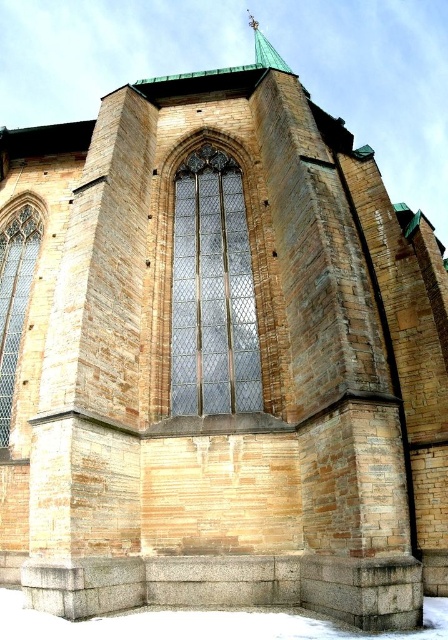
You are standing in front of the historic stone church and want to take a photo of the clear glass window at center. However, you notice the green copper spire at upper center might block your view. Based on the scene description, will the spire block the window in your photo?

The clear glass window at center is positioned under the green copper spire at upper center, so the spire will not block the window in your photo since it is above it.

You are a maintenance worker assessing the church structure. You need to replace the protective film on the clear glass window at left and also inspect the green copper spire at upper center. Which task should you tackle first based on their vertical positions?

The clear glass window at left is below the green copper spire at upper center, so you should replace the protective film on the clear glass window at left first before ascending to inspect the green copper spire at upper center.

You are a maintenance worker tasked with inspecting the clear glass window at center and the green copper spire at upper center. From your current position at ground level, which object would you need to look towards the left side to see?

The clear glass window at center is positioned on the left side of green copper spire at upper center, so you would need to look towards the left side to see the clear glass window at center.